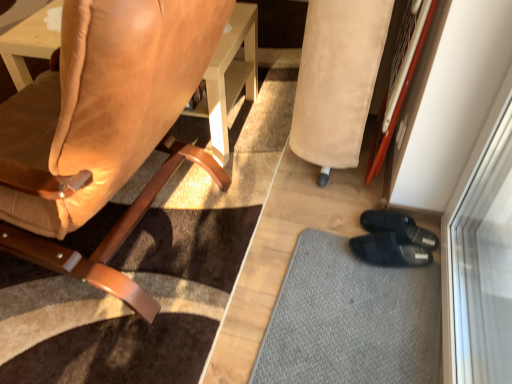
Where is `blank space to the left of gray textured mat at lower right`? The height and width of the screenshot is (384, 512). blank space to the left of gray textured mat at lower right is located at coordinates (244, 285).